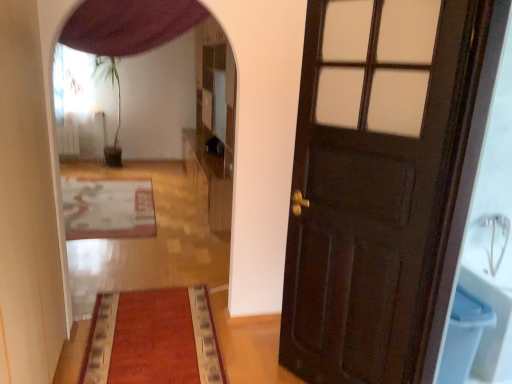
Describe the element at coordinates (213, 124) in the screenshot. I see `wooden dresser at center` at that location.

Describe the element at coordinates (153, 339) in the screenshot. The height and width of the screenshot is (384, 512). I see `velvet red mat at center, which is counted as the 2th mat, starting from the left` at that location.

What is the approximate width of wooden floor mat at center?

wooden floor mat at center is 4.65 meters in width.

The width and height of the screenshot is (512, 384). I want to click on blue plastic toilet bowl at right, so click(x=463, y=336).

Where is `wooden dresser at center`? wooden dresser at center is located at coordinates (213, 124).

Could white textured rug at center, which is the 2th mat from right to left, be considered to be inside wooden floor mat at center?

Yes, wooden floor mat at center contains white textured rug at center, which is the 2th mat from right to left.

Considering the relative sizes of wooden floor mat at center and white textured rug at center, which is counted as the 1th mat, starting from the back, in the image provided, is wooden floor mat at center shorter than white textured rug at center, which is counted as the 1th mat, starting from the back,?

No, wooden floor mat at center is not shorter than white textured rug at center, which is counted as the 1th mat, starting from the back.

From a real-world perspective, is wooden floor mat at center positioned over white textured rug at center, acting as the first mat starting from the top, based on gravity?

Correct, in the physical world, wooden floor mat at center is higher than white textured rug at center, acting as the first mat starting from the top.

From the image's perspective, does wooden floor mat at center appear higher than white textured rug at center, acting as the first mat starting from the top?

No, from the image's perspective, wooden floor mat at center is not on top of white textured rug at center, acting as the first mat starting from the top.

Is wooden dresser at center positioned far away from wooden floor mat at center?

No, wooden dresser at center is not far away from wooden floor mat at center.

Is wooden dresser at center aimed at wooden floor mat at center?

Yes, wooden dresser at center is facing wooden floor mat at center.

Considering the relative sizes of wooden dresser at center and wooden floor mat at center in the image provided, is wooden dresser at center bigger than wooden floor mat at center?

Yes, wooden dresser at center is bigger than wooden floor mat at center.

Which object is thinner, dark wood door at right or velvet red mat at center, positioned as the first mat in right-to-left order?

dark wood door at right is thinner.

Locate an element on the screen. Image resolution: width=512 pixels, height=384 pixels. door on the right side of velvet red mat at center, which is the 1th mat in front-to-back order is located at coordinates (378, 187).

From the image's perspective, does dark wood door at right appear lower than velvet red mat at center, which is the 1th mat in front-to-back order?

No, from the image's perspective, dark wood door at right is not beneath velvet red mat at center, which is the 1th mat in front-to-back order.

Measure the distance between wooden dresser at center and dark wood door at right.

wooden dresser at center and dark wood door at right are 2.76 meters apart from each other.

Could you tell me if wooden dresser at center is facing dark wood door at right?

No, wooden dresser at center does not turn towards dark wood door at right.

Is wooden dresser at center not near dark wood door at right?

wooden dresser at center is far away from dark wood door at right.

Is wooden dresser at center smaller than dark wood door at right?

Actually, wooden dresser at center might be larger than dark wood door at right.

Can you tell me how much purple fabric curtain at upper center and velvet red mat at center, which is the 1th mat in front-to-back order, differ in facing direction?

The angular difference between purple fabric curtain at upper center and velvet red mat at center, which is the 1th mat in front-to-back order, is 90.4 degrees.

From a real-world perspective, which mat is the 2nd one underneath the purple fabric curtain at upper center? Please provide its 2D coordinates.

[(153, 339)]

Considering the sizes of objects purple fabric curtain at upper center and velvet red mat at center, the 1th mat positioned from the bottom, in the image provided, who is thinner, purple fabric curtain at upper center or velvet red mat at center, the 1th mat positioned from the bottom,?

purple fabric curtain at upper center is thinner.

Considering the positions of objects purple fabric curtain at upper center and velvet red mat at center, the 1th mat positioned from the bottom, in the image provided, who is more to the left, purple fabric curtain at upper center or velvet red mat at center, the 1th mat positioned from the bottom,?

From the viewer's perspective, purple fabric curtain at upper center appears more on the left side.

Find the location of a particular element. curtain that is behind the dark wood door at right is located at coordinates click(x=129, y=25).

Which of these two, purple fabric curtain at upper center or dark wood door at right, is smaller?

Smaller between the two is purple fabric curtain at upper center.

From a real-world perspective, between purple fabric curtain at upper center and dark wood door at right, who is vertically higher?

purple fabric curtain at upper center, from a real-world perspective.

Is purple fabric curtain at upper center positioned far away from dark wood door at right?

Yes.

From the image's perspective, is purple fabric curtain at upper center positioned above or below wooden floor mat at center?

purple fabric curtain at upper center is situated higher than wooden floor mat at center in the image.

Is purple fabric curtain at upper center closer to camera compared to wooden floor mat at center?

Yes.

Is purple fabric curtain at upper center inside or outside of wooden floor mat at center?

purple fabric curtain at upper center is not enclosed by wooden floor mat at center.

Who is bigger, purple fabric curtain at upper center or wooden floor mat at center?

wooden floor mat at center is bigger.

Where is `mat on the left of wooden floor mat at center`? The image size is (512, 384). mat on the left of wooden floor mat at center is located at coordinates (108, 209).

Where is `dresser behind the wooden floor mat at center`? The image size is (512, 384). dresser behind the wooden floor mat at center is located at coordinates (213, 124).

Which object lies nearer to the anchor point wooden dresser at center, wooden floor mat at center or dark wood door at right?

wooden floor mat at center.

Which object lies nearer to the anchor point wooden floor mat at center, white textured rug at center, acting as the first mat starting from the top, or wooden dresser at center?

white textured rug at center, acting as the first mat starting from the top, lies closer to wooden floor mat at center than the other object.

Estimate the real-world distances between objects in this image. Which object is closer to blue plastic toilet bowl at right, wooden dresser at center or wooden floor mat at center?

The object closer to blue plastic toilet bowl at right is wooden floor mat at center.

Looking at the image, which one is located further to dark wood door at right, wooden dresser at center or purple fabric curtain at upper center?

wooden dresser at center is further to dark wood door at right.

Considering their positions, is wooden floor mat at center positioned closer to dark wood door at right than purple fabric curtain at upper center?

purple fabric curtain at upper center lies closer to dark wood door at right than the other object.

Which object lies further to the anchor point wooden dresser at center, purple fabric curtain at upper center or wooden floor mat at center?

purple fabric curtain at upper center lies further to wooden dresser at center than the other object.

From the image, which object appears to be farther from velvet red mat at center, the second mat when ordered from top to bottom, wooden dresser at center or white textured rug at center, positioned as the 2th mat in front-to-back order?

wooden dresser at center lies further to velvet red mat at center, the second mat when ordered from top to bottom, than the other object.

Which object lies nearer to the anchor point dark wood door at right, white textured rug at center, which is the 2th mat from right to left, or wooden dresser at center?

wooden dresser at center.

Identify the location of dresser between white textured rug at center, which is counted as the 1th mat, starting from the back, and blue plastic toilet bowl at right, in the horizontal direction. (213, 124).

Image resolution: width=512 pixels, height=384 pixels. What are the coordinates of `toilet bowl between dark wood door at right and wooden dresser at center from front to back` in the screenshot? It's located at (463, 336).

Locate an element on the screen. Image resolution: width=512 pixels, height=384 pixels. path between purple fabric curtain at upper center and wooden dresser at center along the z-axis is located at coordinates (147, 239).

This screenshot has width=512, height=384. In order to click on dresser situated between wooden floor mat at center and blue plastic toilet bowl at right from left to right in this screenshot , I will do `click(213, 124)`.